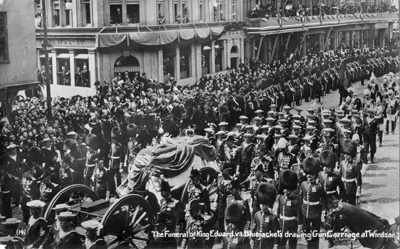
Where is `floor`? floor is located at coordinates (387, 185).